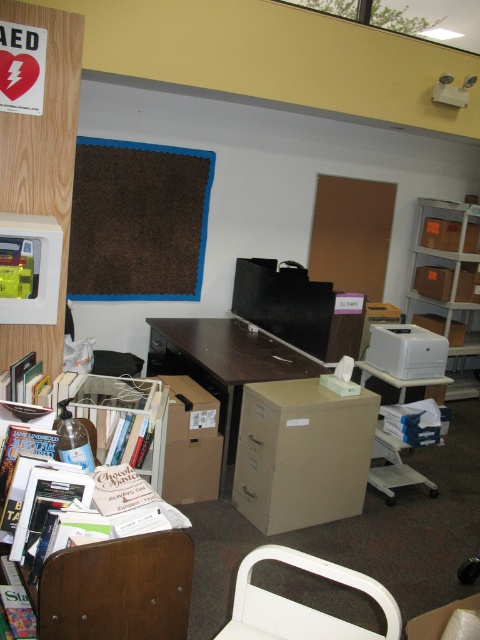
You are organizing the office and need to move a large box from the matte cardboard bookshelf at right to the white matte printer at center right. Given that the box is 3 feet wide, will there be enough space to move it between them?

The distance between the matte cardboard bookshelf at right and the white matte printer at center right is 6.37 feet. Since the box is 3 feet wide, there is sufficient space to move it between them as the distance is more than double the box width.

You are organizing the office and need to move the white plastic chair at lower center. Can you move it freely without moving the brown cardboard file cabinet at center first?

The brown cardboard file cabinet at center is positioned over white plastic chair at lower center, so you must move the file cabinet first to access the chair.

Please describe the exact 2D coordinates of the beige cardboard file cabinet at center in the image.

The beige cardboard file cabinet at center is located at the 2D coordinates of point (301,452).